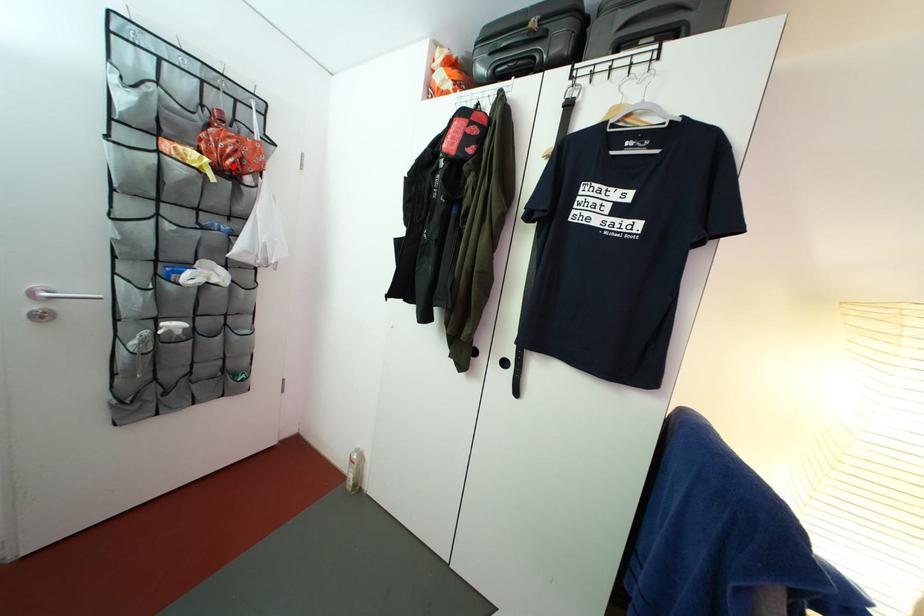
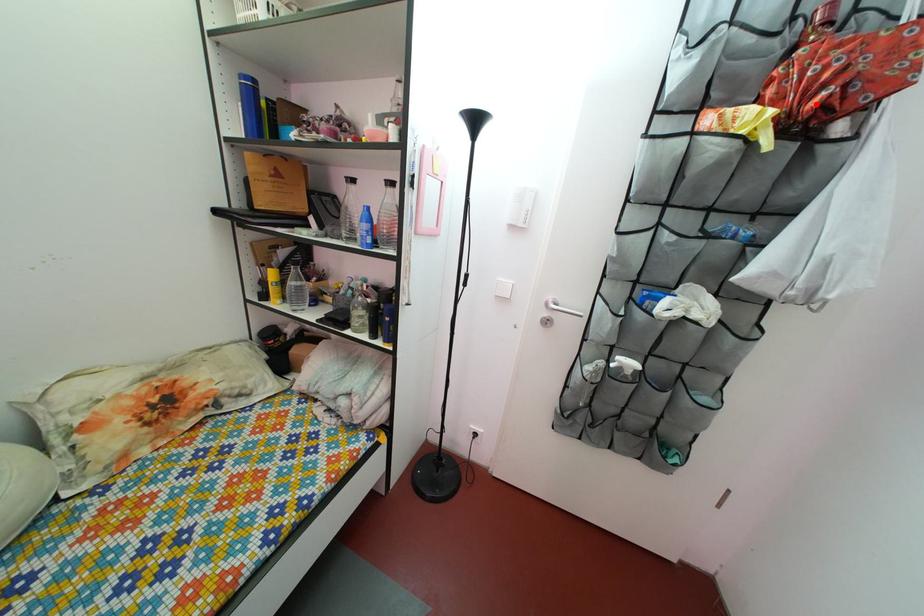
I am providing you with two images of the same scene from different viewpoints. A red point is marked on the first image and another point is marked on the second image. Do the highlighted points in image1 and image2 indicate the same real-world spot?

Yes